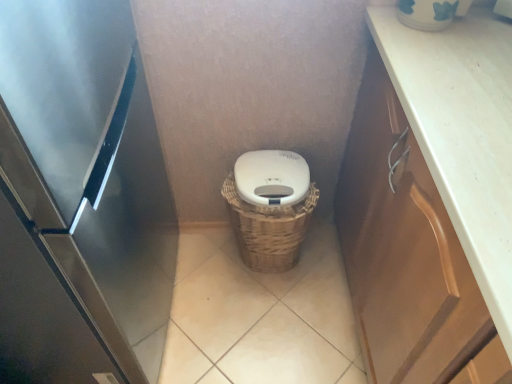
I want to click on vacant region to the left of woven brown basket at center, so click(199, 268).